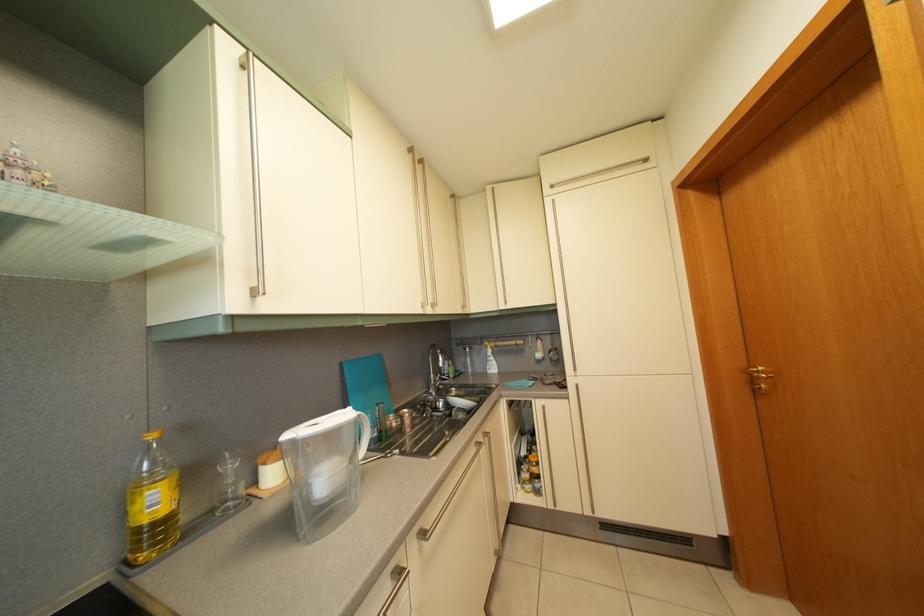
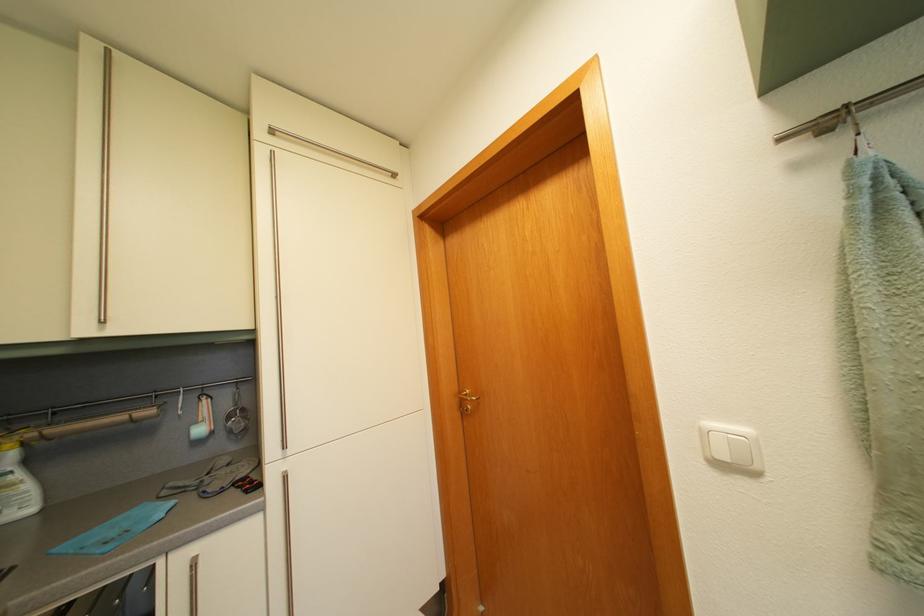
In the second image, find the point that corresponds to (x=500, y=365) in the first image.

(26, 484)